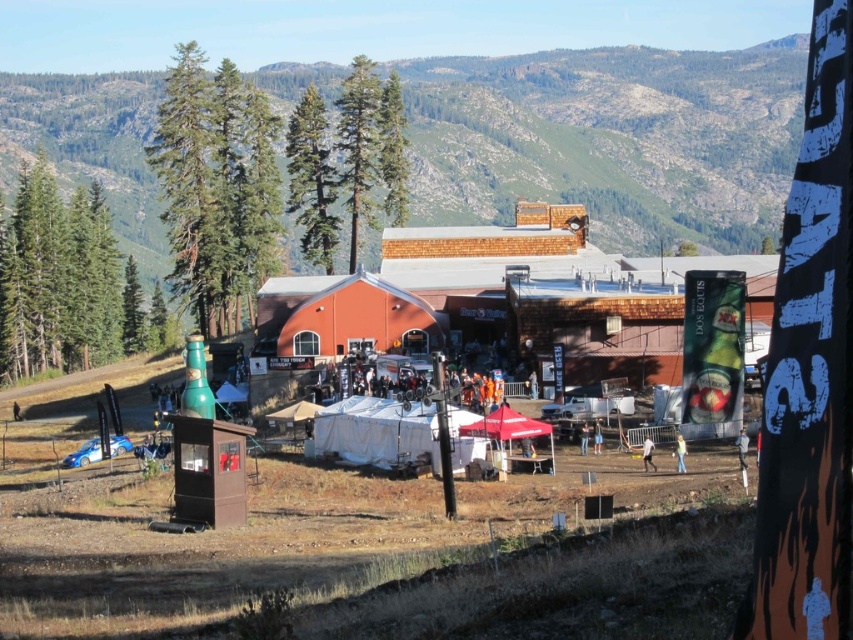
Question: Does green textured mountain at upper center appear on the left side of green textured pine tree at upper center?

Choices:
 (A) no
 (B) yes

Answer: (A)

Question: Which point is farther from the camera taking this photo?

Choices:
 (A) (778, 116)
 (B) (354, 253)
 (C) (132, 320)

Answer: (A)

Question: Which of these objects is positioned closest to the green textured tree at left?

Choices:
 (A) green textured mountain at upper center
 (B) green coniferous tree at upper center

Answer: (B)

Question: Is green textured mountain at upper center to the right of green textured pine tree at upper center from the viewer's perspective?

Choices:
 (A) no
 (B) yes

Answer: (B)

Question: Does green coniferous tree at upper center appear under green textured pine tree at upper center?

Choices:
 (A) no
 (B) yes

Answer: (A)

Question: Considering the real-world distances, which object is farthest from the green textured tree at left?

Choices:
 (A) green textured mountain at upper center
 (B) green coniferous tree at upper center

Answer: (A)